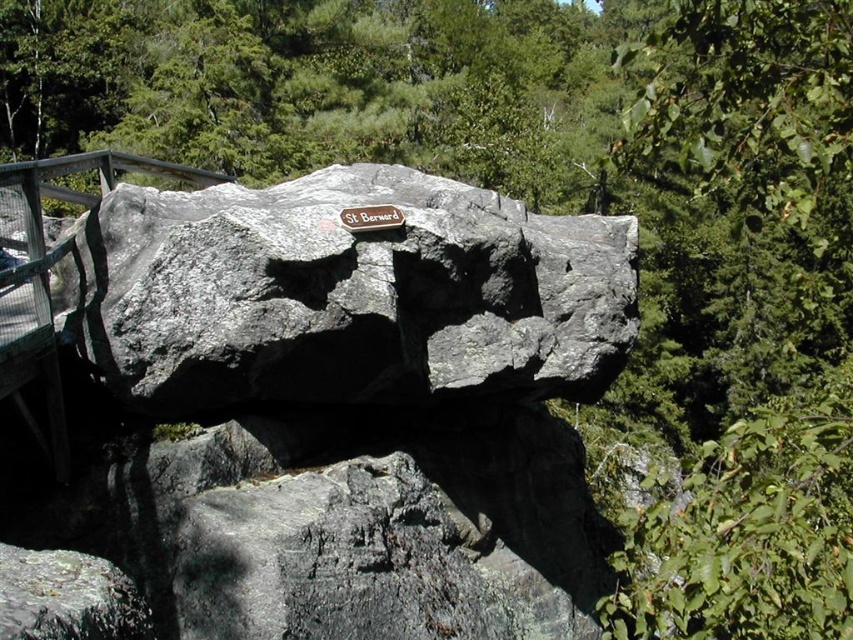
In the scene shown: Which of these two, gray rough rock at center or metallic plaque at center, stands taller?

With more height is gray rough rock at center.

Image resolution: width=853 pixels, height=640 pixels. What do you see at coordinates (346, 294) in the screenshot?
I see `gray rough rock at center` at bounding box center [346, 294].

Does point (418, 289) lie behind point (364, 216)?

Yes, it is behind point (364, 216).

I want to click on gray rough rock at center, so click(x=346, y=294).